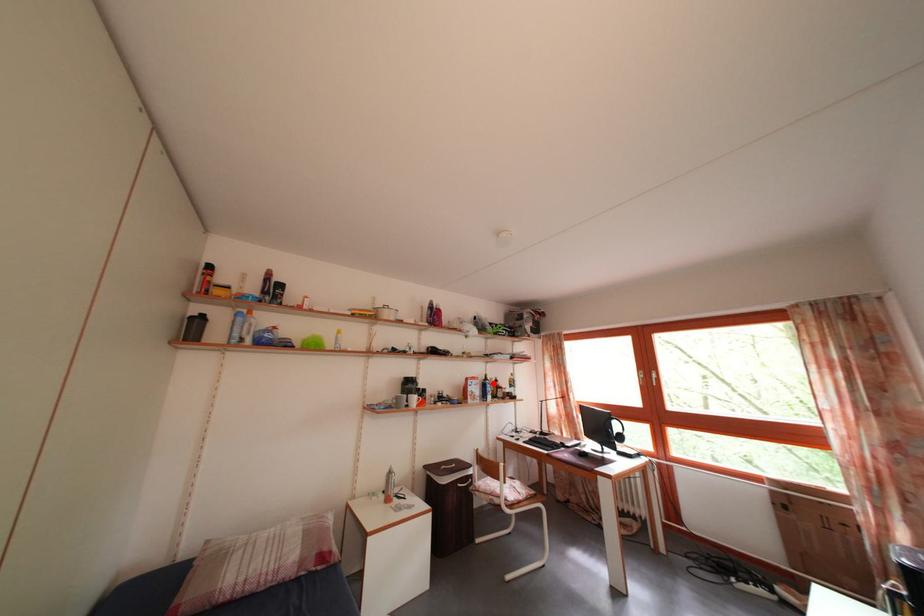
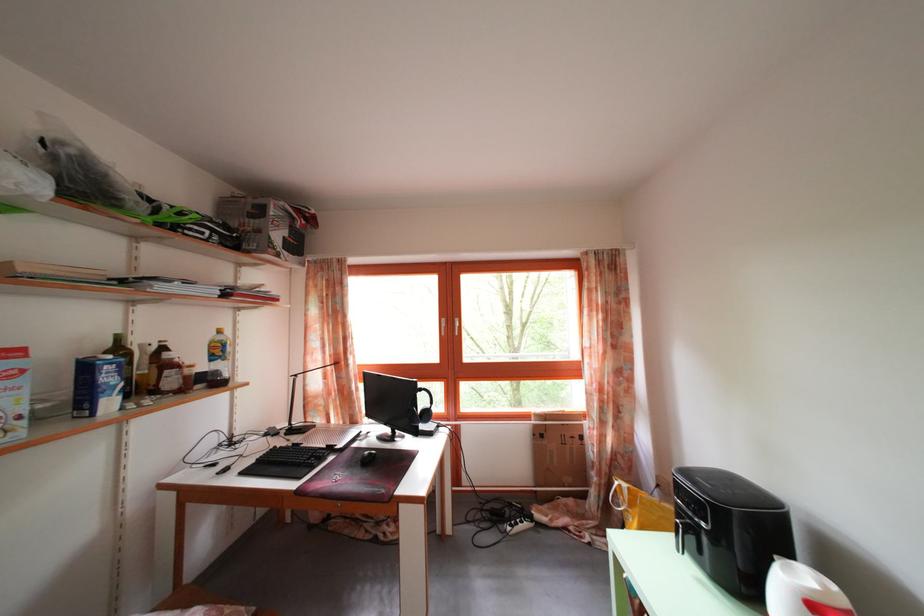
Question: A red point is marked in image1. In image2, is the corresponding 3D point closer to the camera or farther? Reply with the corresponding letter.

Choices:
 (A) The corresponding 3D point is closer.
 (B) The corresponding 3D point is farther.

Answer: (A)